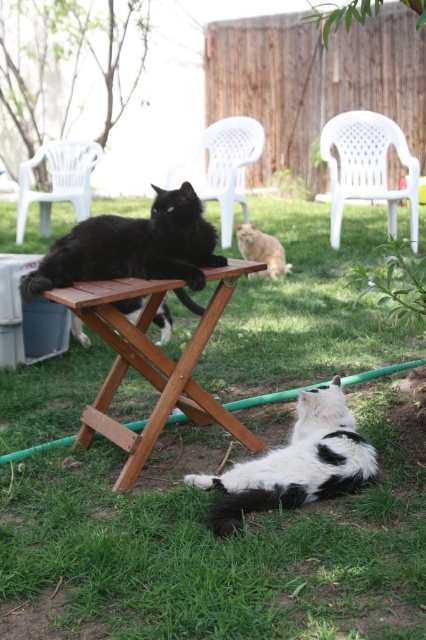
Is the position of white plastic chair at center more distant than that of white plastic chair at upper left?

That is False.

Is point (244, 177) closer to viewer compared to point (86, 188)?

That is False.

Find the location of a particular element. white plastic chair at center is located at coordinates (221, 166).

Who is positioned more to the left, green grass at center or black glossy cat at center?

From the viewer's perspective, black glossy cat at center appears more on the left side.

Which is above, green grass at center or black glossy cat at center?

black glossy cat at center is above.

The image size is (426, 640). Describe the element at coordinates (215, 545) in the screenshot. I see `green grass at center` at that location.

Find the location of a particular element. The height and width of the screenshot is (640, 426). green grass at center is located at coordinates (215, 545).

Is black glossy cat at center wider than black and white fur cat at lower center?

Yes, black glossy cat at center is wider than black and white fur cat at lower center.

Measure the distance between black glossy cat at center and camera.

2.39 meters

Does point (75, 250) come in front of point (227, 515)?

No.

This screenshot has width=426, height=640. In order to click on black glossy cat at center in this screenshot , I will do `click(132, 246)`.